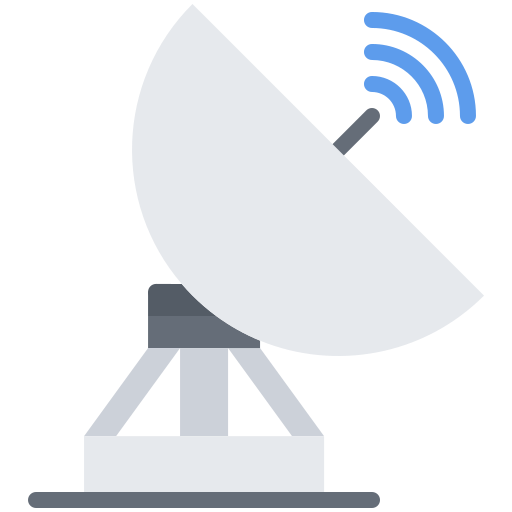
The height and width of the screenshot is (512, 512). I want to click on bottom edge of the dish, so tap(469, 293).